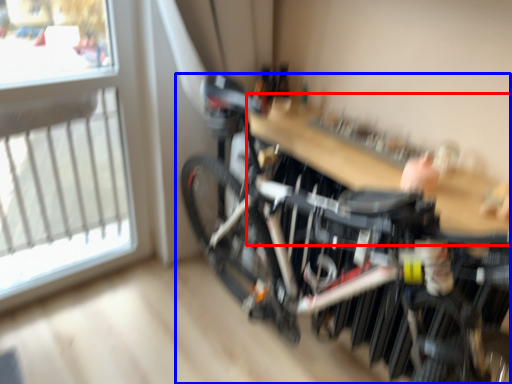
Question: Which point is closer to the camera, table (highlighted by a red box) or bicycle (highlighted by a blue box)?

Choices:
 (A) table
 (B) bicycle

Answer: (B)